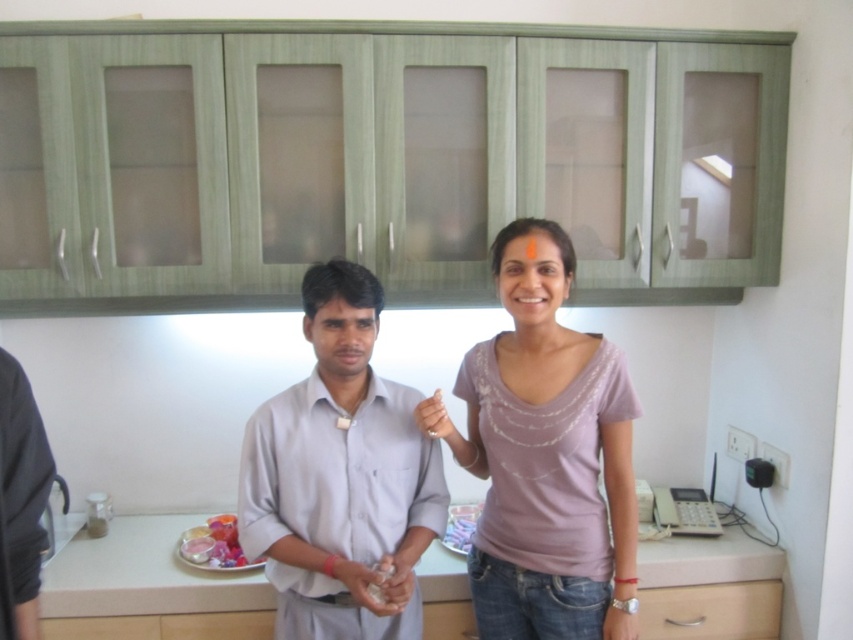
Question: Which point is closer to the camera?

Choices:
 (A) (434, 422)
 (B) (225, 560)
 (C) (567, 346)

Answer: (A)

Question: Is light gray cotton shirt at center thinner than white matte hand at center?

Choices:
 (A) yes
 (B) no

Answer: (B)

Question: Which object is closer to the camera taking this photo?

Choices:
 (A) white matte hand at center
 (B) glossy plastic containers at lower center

Answer: (A)

Question: From the image, what is the correct spatial relationship of purple matte shirt at center in relation to white matte hand at center?

Choices:
 (A) above
 (B) below

Answer: (B)

Question: Which point appears closest to the camera in this image?

Choices:
 (A) (360, 468)
 (B) (190, 528)
 (C) (614, 348)
 (D) (433, 420)

Answer: (A)

Question: Can you confirm if light gray cotton shirt at center is positioned to the left of white matte hand at center?

Choices:
 (A) yes
 (B) no

Answer: (A)